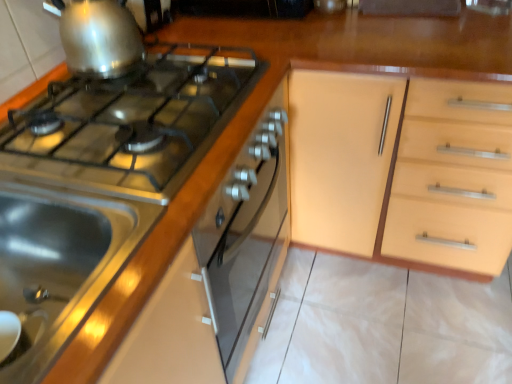
Question: From the image's perspective, is shiny metallic kettle at upper left, which is counted as the 2th kitchen appliance, starting from the bottom, on stainless steel sink at lower left?

Choices:
 (A) no
 (B) yes

Answer: (B)

Question: Is shiny metallic kettle at upper left, arranged as the first kitchen appliance when viewed from the top, positioned before stainless steel sink at lower left?

Choices:
 (A) yes
 (B) no

Answer: (B)

Question: Does shiny metallic kettle at upper left, which is counted as the 2th kitchen appliance, starting from the bottom, have a lesser height compared to stainless steel sink at lower left?

Choices:
 (A) no
 (B) yes

Answer: (B)

Question: From a real-world perspective, is shiny metallic kettle at upper left, which is counted as the 2th kitchen appliance, starting from the bottom, on stainless steel sink at lower left?

Choices:
 (A) yes
 (B) no

Answer: (A)

Question: Is stainless steel sink at lower left completely or partially inside shiny metallic kettle at upper left, arranged as the first kitchen appliance when viewed from the top?

Choices:
 (A) no
 (B) yes

Answer: (A)

Question: Does shiny metallic kettle at upper left, which is counted as the 2th kitchen appliance, starting from the bottom, have a greater width compared to stainless steel sink at lower left?

Choices:
 (A) yes
 (B) no

Answer: (B)

Question: Could you tell me if stainless steel stove at upper left, the second kitchen appliance when ordered from top to bottom, is facing shiny metallic kettle at upper left, which is counted as the 2th kitchen appliance, starting from the bottom?

Choices:
 (A) yes
 (B) no

Answer: (B)

Question: Is stainless steel stove at upper left, which is counted as the 1th kitchen appliance, starting from the bottom, wider than shiny metallic kettle at upper left, arranged as the first kitchen appliance when viewed from the top?

Choices:
 (A) no
 (B) yes

Answer: (B)

Question: Can you confirm if stainless steel stove at upper left, the second kitchen appliance when ordered from top to bottom, is positioned to the left of shiny metallic kettle at upper left, arranged as the first kitchen appliance when viewed from the top?

Choices:
 (A) no
 (B) yes

Answer: (A)

Question: Is stainless steel stove at upper left, the second kitchen appliance when ordered from top to bottom, completely or partially outside of shiny metallic kettle at upper left, which is counted as the 2th kitchen appliance, starting from the bottom?

Choices:
 (A) no
 (B) yes

Answer: (B)

Question: From the image's perspective, is stainless steel stove at upper left, which is counted as the 1th kitchen appliance, starting from the bottom, over shiny metallic kettle at upper left, arranged as the first kitchen appliance when viewed from the top?

Choices:
 (A) yes
 (B) no

Answer: (B)

Question: Does stainless steel stove at upper left, the second kitchen appliance when ordered from top to bottom, lie in front of shiny metallic kettle at upper left, which is counted as the 2th kitchen appliance, starting from the bottom?

Choices:
 (A) no
 (B) yes

Answer: (B)

Question: Is stainless steel stove at upper left, which is counted as the 1th kitchen appliance, starting from the bottom, shorter than satin silver gas stove at left?

Choices:
 (A) no
 (B) yes

Answer: (A)